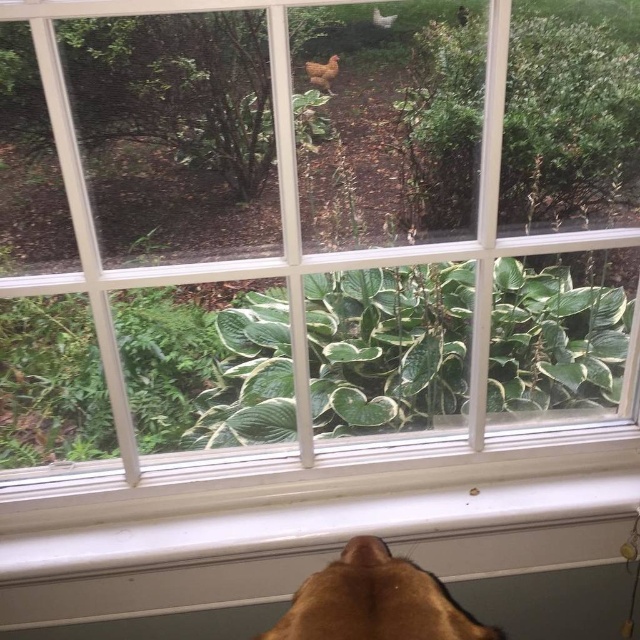
You are standing in front of the window and want to touch the green leafy plant at center and the green leafy plant at upper center. Which one can you reach first without moving your position?

The green leafy plant at center is closer to the viewer than the green leafy plant at upper center, so you can reach it first without moving your position.

You are standing in front of the window and see the green leafy plant at center. Can you tell me the exact coordinates of where it is located?

The green leafy plant at center is located at point [205,365].